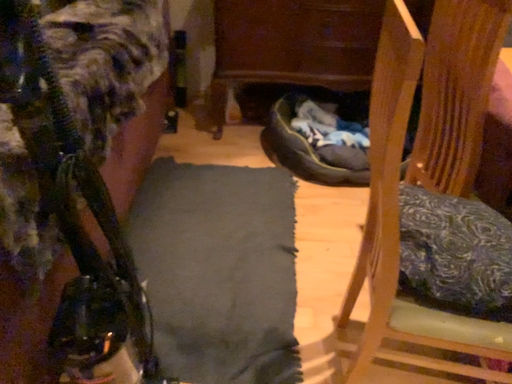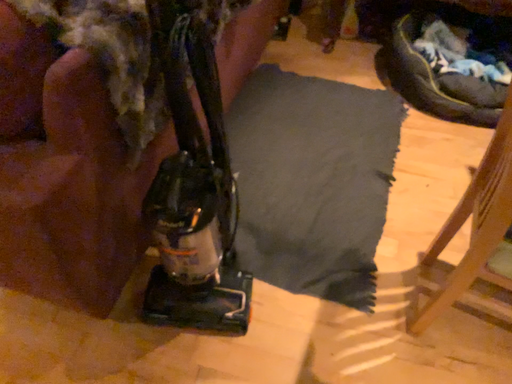
Question: How did the camera likely rotate when shooting the video?

Choices:
 (A) rotated upward
 (B) rotated downward

Answer: (B)